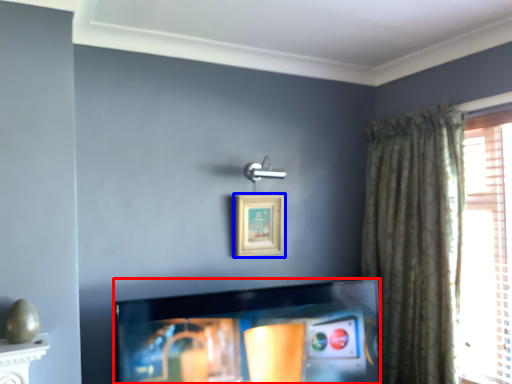
Question: Which object is further to the camera taking this photo, television (highlighted by a red box) or picture frame (highlighted by a blue box)?

Choices:
 (A) television
 (B) picture frame

Answer: (B)